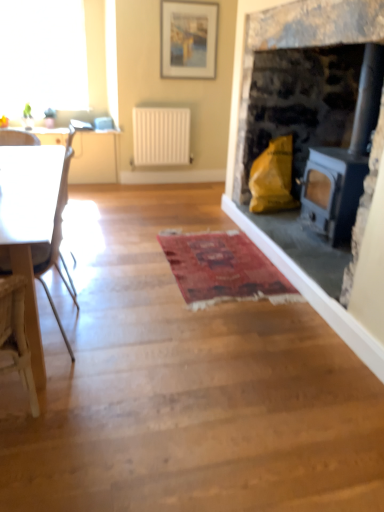
Identify the location of free space to the back side of white plastic chair at left. The image size is (384, 512). (111, 294).